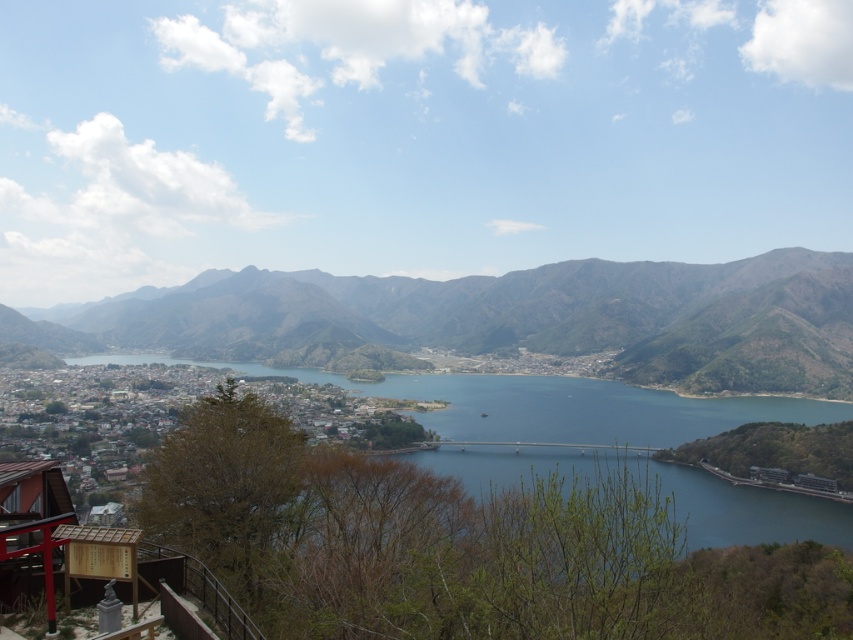
Measure the distance between brown textured mountains at center and blue glassy water at center.

brown textured mountains at center and blue glassy water at center are 123.30 meters apart from each other.

Is brown textured mountains at center bigger than blue glassy water at center?

Yes.

Where is `brown textured mountains at center`? brown textured mountains at center is located at coordinates (514, 317).

This screenshot has height=640, width=853. I want to click on brown textured mountains at center, so click(514, 317).